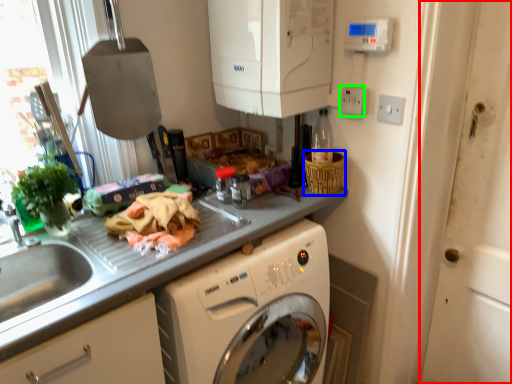
Question: Which object is positioned farthest from screen door (highlighted by a red box)? Select from basket (highlighted by a blue box) and electric outlet (highlighted by a green box).

Choices:
 (A) basket
 (B) electric outlet

Answer: (B)